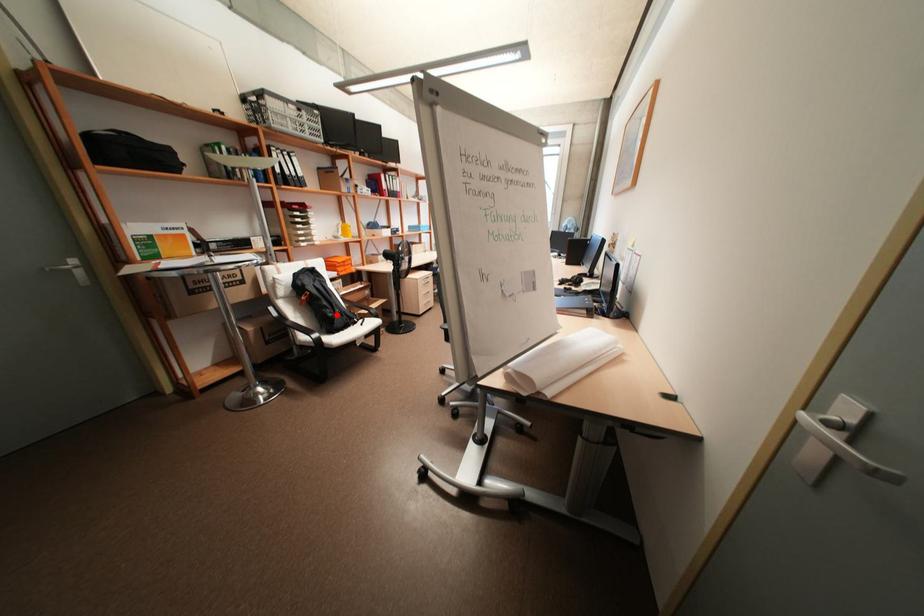
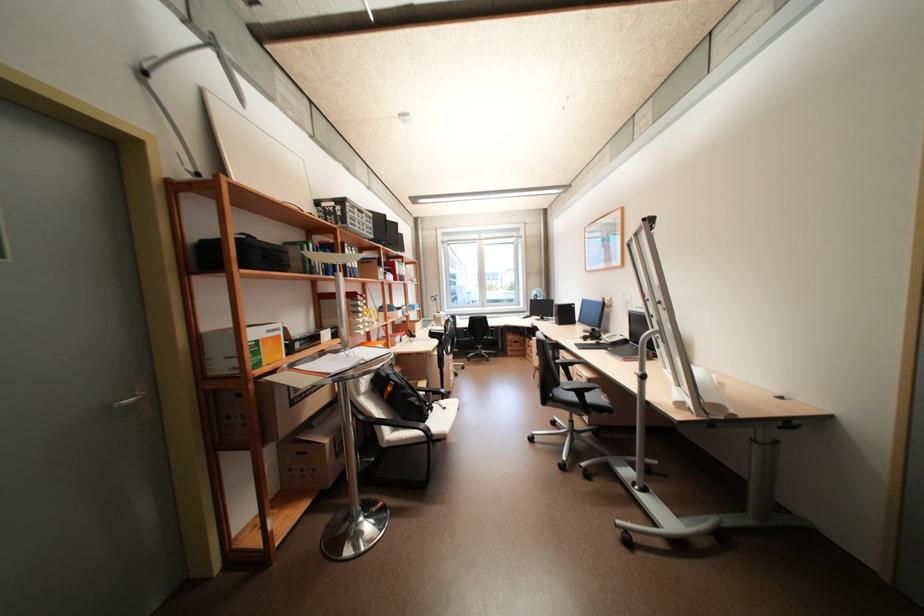
Question: I am providing you with two images of the same scene from different viewpoints. Given a red point in image1, look at the same physical point in image2. Is it:

Choices:
 (A) Closer to the viewpoint
 (B) Farther from the viewpoint

Answer: (B)